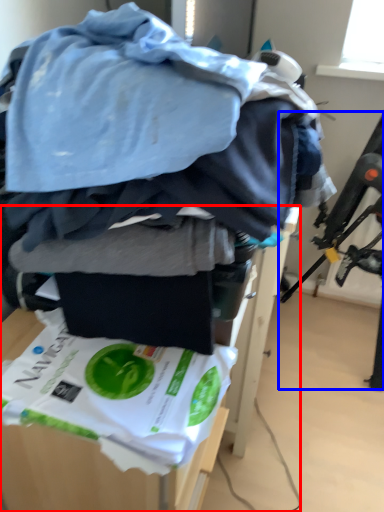
Question: Among these objects, which one is nearest to the camera, furniture (highlighted by a red box) or swivel chair (highlighted by a blue box)?

Choices:
 (A) furniture
 (B) swivel chair

Answer: (A)